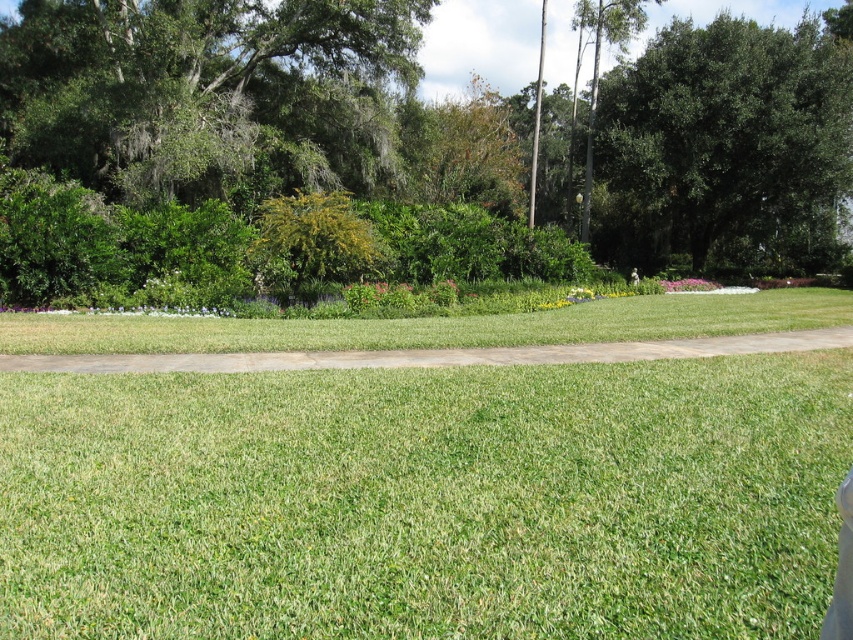
You are standing at the bottom of the image and looking up. Which object is located at the coordinates point (407, 147)?

The point (407, 147) corresponds to the green leafy tree at upper center.

You are planning to install a small bench between the green leafy tree at upper center and the green leafy tree at upper right. Based on their widths, which tree would require more space on either side of the bench?

The green leafy tree at upper center might require more space on either side of the bench since it might be wider than the green leafy tree at upper right.

You are standing at the center of the paved pathway in the grassy area. Which direction should you look to see the green leafy tree at upper center?

The green leafy tree at upper center is located at point (407, 147), so you should look towards the upper center direction to see it.